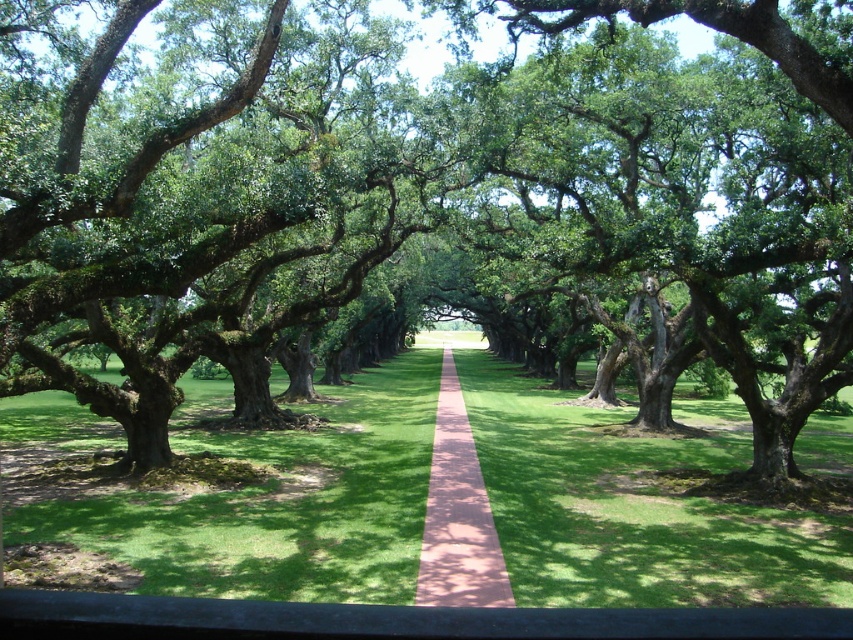
You are standing on the pink concrete path at center and want to step onto the green grass at center. Which direction should you move to reach the grass?

The green grass at center is closer to the viewer than the pink concrete path at center, so you should move forward towards the grass to reach it.

You are a gardener who wants to mow the green grass at center using a lawnmower that is 2 feet wide. The pink concrete path at center is in the way. Can you move the lawnmower sideways along the path without hitting the path?

The distance between the green grass at center and the pink concrete path at center is 14.17 feet. Since the lawnmower is only 2 feet wide, there is enough space to move it sideways along the path without hitting the path.

You are a gardener planning to mow the green grass at center and the pink concrete path at center. Which area requires a wider mower to accommodate its size?

The green grass at center requires a wider mower since it has a larger size compared to the pink concrete path at center.